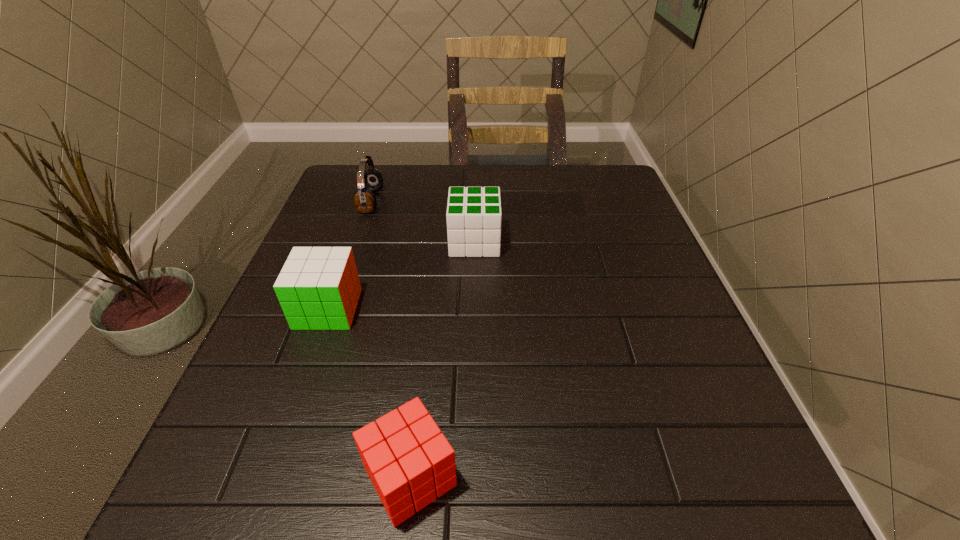
Where is `free space that satisfies the following two spatial constraints: 1. on the ear cups of the shortest cube; 2. on the left side of the headset`? Image resolution: width=960 pixels, height=540 pixels. free space that satisfies the following two spatial constraints: 1. on the ear cups of the shortest cube; 2. on the left side of the headset is located at coordinates (278, 476).